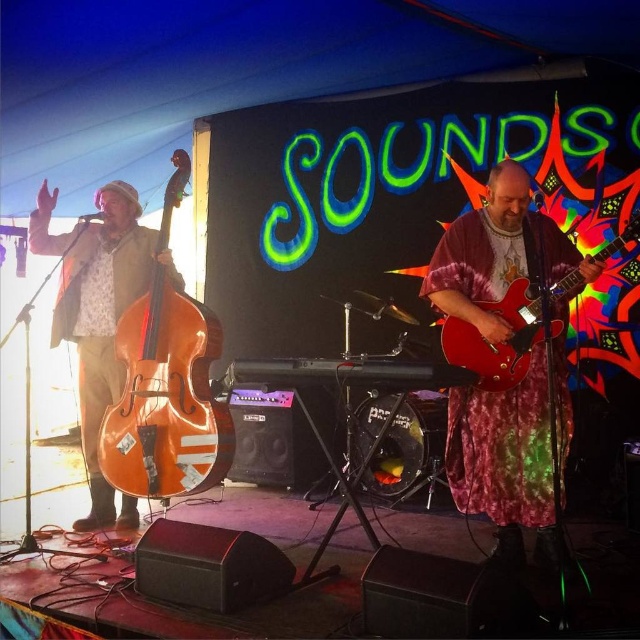
You are standing in front of the stage and want to locate the shiny red guitar at center. According to the coordinates given, where would you look?

The shiny red guitar at center is located at coordinates point (504, 460).

Consider the image. You are standing at the center of the stage and want to move towards the shiny red guitar at center. Which direction should you go?

The shiny red guitar at center is located at point (504, 460), so you should move towards the lower right direction from the center of the stage.